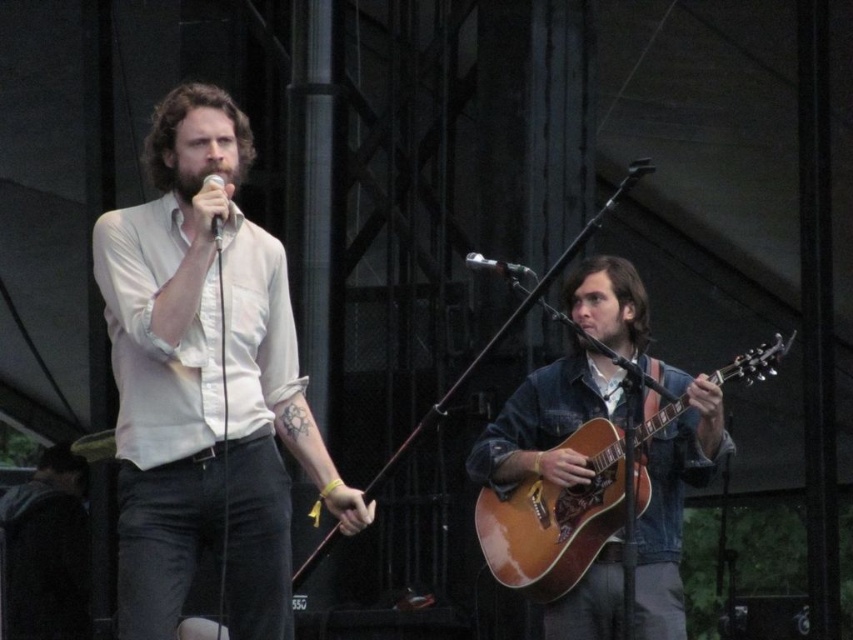
Can you confirm if black leather jacket at lower left is bigger than metallic silver microphone at center?

Indeed, black leather jacket at lower left has a larger size compared to metallic silver microphone at center.

Can you confirm if black leather jacket at lower left is shorter than metallic silver microphone at center?

No.

This screenshot has height=640, width=853. What do you see at coordinates (47, 550) in the screenshot?
I see `black leather jacket at lower left` at bounding box center [47, 550].

Locate an element on the screen. This screenshot has width=853, height=640. black leather jacket at lower left is located at coordinates (47, 550).

Who is shorter, white cotton shirt at center or black leather jacket at lower left?

With less height is black leather jacket at lower left.

Between white cotton shirt at center and black leather jacket at lower left, which one has more height?

Standing taller between the two is white cotton shirt at center.

Is point (289, 561) behind point (27, 579)?

No.

In order to click on white cotton shirt at center in this screenshot , I will do `click(206, 384)`.

Who is positioned more to the right, wooden acoustic guitar at right or matte black microphone at upper center?

wooden acoustic guitar at right is more to the right.

Can you confirm if wooden acoustic guitar at right is wider than matte black microphone at upper center?

Yes.

Describe the element at coordinates (555, 516) in the screenshot. Image resolution: width=853 pixels, height=640 pixels. I see `wooden acoustic guitar at right` at that location.

Where is `wooden acoustic guitar at right`? wooden acoustic guitar at right is located at coordinates (555, 516).